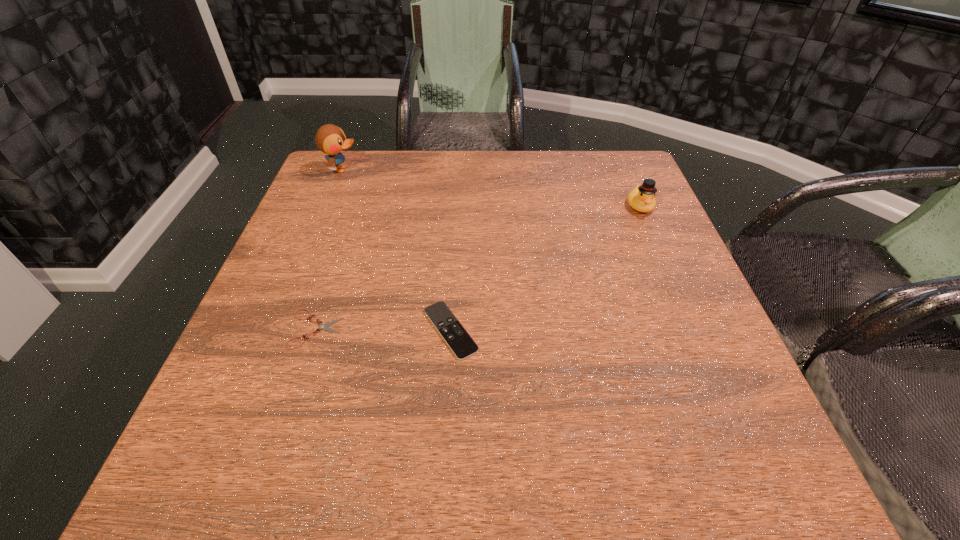
Where is `the taller duck`? The width and height of the screenshot is (960, 540). the taller duck is located at coordinates [x=330, y=139].

I want to click on the farther duck, so click(330, 139).

In order to click on the third nearest object in this screenshot , I will do `click(641, 198)`.

Find the location of a particular element. This screenshot has height=540, width=960. the rightmost object is located at coordinates (641, 198).

The image size is (960, 540). In order to click on remote control in this screenshot , I will do `click(462, 345)`.

Find the location of a particular element. This screenshot has height=540, width=960. the second object from right to left is located at coordinates (462, 345).

This screenshot has height=540, width=960. What are the coordinates of `the shortest object` in the screenshot? It's located at (324, 327).

Locate an element on the screen. The image size is (960, 540). free region located 0.400m on the front-facing side of the left duck is located at coordinates (503, 170).

This screenshot has width=960, height=540. What are the coordinates of `free spot located on the front-facing side of the rightmost object` in the screenshot? It's located at (682, 304).

Locate an element on the screen. This screenshot has width=960, height=540. vacant space located on the right of the third tallest object is located at coordinates (537, 330).